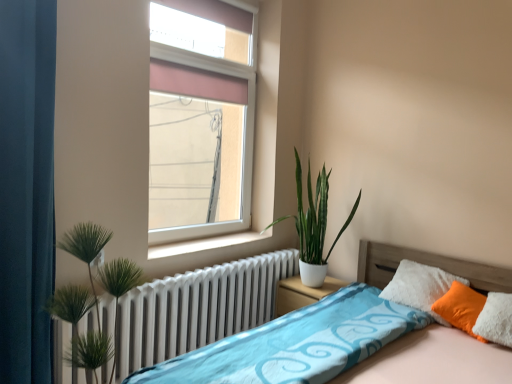
Question: From a real-world perspective, relative to white metallic radiator at lower left, is white matte nightstand at center vertically above or below?

Choices:
 (A) below
 (B) above

Answer: (A)

Question: Relative to white metallic radiator at lower left, is white matte nightstand at center in front or behind?

Choices:
 (A) behind
 (B) front

Answer: (A)

Question: Which object is the farthest from the teal fabric curtain at left?

Choices:
 (A) orange fabric pillow at right
 (B) pink fabric window at upper center
 (C) white matte nightstand at center
 (D) green leafy plant at left
 (E) green glossy plant at center

Answer: (A)

Question: Which of these objects is positioned closest to the white metallic radiator at lower left?

Choices:
 (A) orange fabric pillow at right
 (B) white smooth window sill at center
 (C) pink fabric window at upper center
 (D) green glossy plant at center
 (E) white matte nightstand at center

Answer: (B)